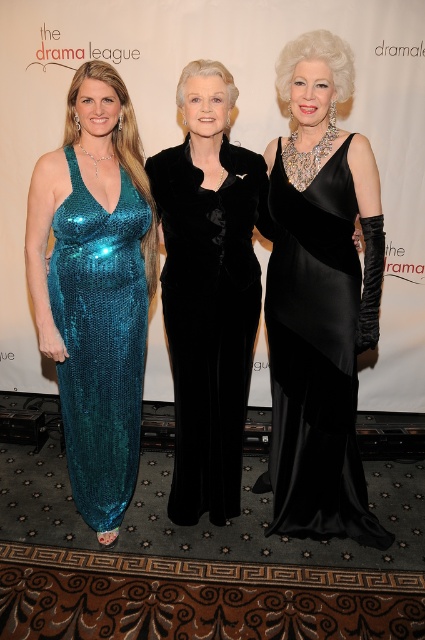
Can you confirm if satin black dress at center is positioned above teal sequined dress at center?

No.

Is satin black dress at center shorter than teal sequined dress at center?

In fact, satin black dress at center may be taller than teal sequined dress at center.

Is point (331, 516) positioned behind point (110, 488)?

That is True.

Locate an element on the screen. satin black dress at center is located at coordinates (316, 356).

What do you see at coordinates (209, 291) in the screenshot?
I see `velvet black dress at center` at bounding box center [209, 291].

Is velvet black dress at center smaller than teal sequined dress at center?

No.

Which is in front, point (218, 464) or point (144, 276)?

Point (144, 276) is more forward.

The width and height of the screenshot is (425, 640). I want to click on velvet black dress at center, so click(209, 291).

Does velvet black dress at center lie in front of satin black dress at center?

Yes, it is.

Who is taller, velvet black dress at center or satin black dress at center?

Standing taller between the two is velvet black dress at center.

Where is `velvet black dress at center`? The width and height of the screenshot is (425, 640). velvet black dress at center is located at coordinates (209, 291).